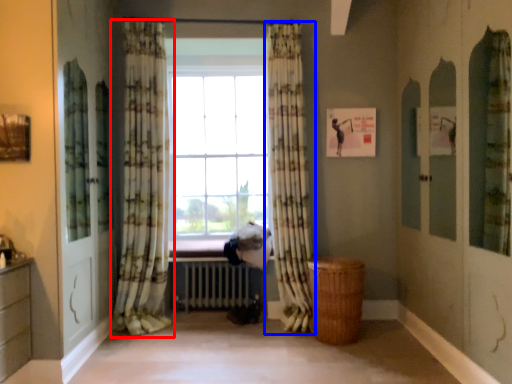
Question: Which of the following is the closest to the observer, curtain (highlighted by a red box) or curtain (highlighted by a blue box)?

Choices:
 (A) curtain
 (B) curtain

Answer: (A)